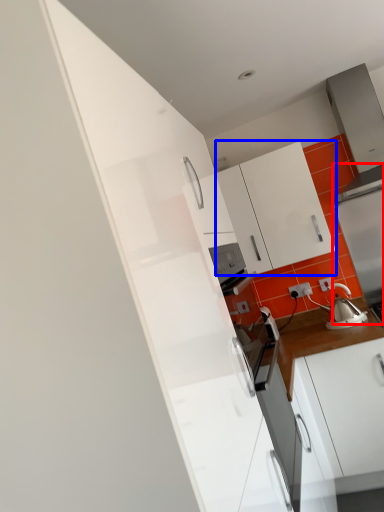
Question: Which of the following is the closest to the observer, appliance (highlighted by a red box) or cabinetry (highlighted by a blue box)?

Choices:
 (A) appliance
 (B) cabinetry

Answer: (B)